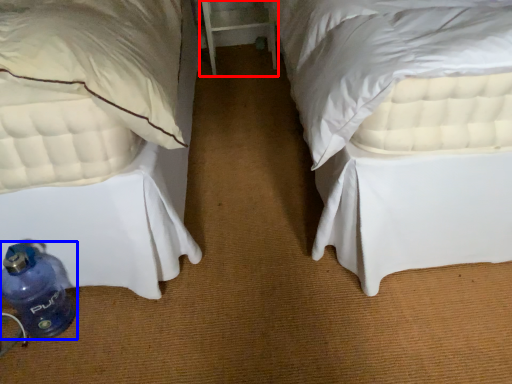
Question: Which object appears farthest to the camera in this image, table (highlighted by a red box) or bottle (highlighted by a blue box)?

Choices:
 (A) table
 (B) bottle

Answer: (A)